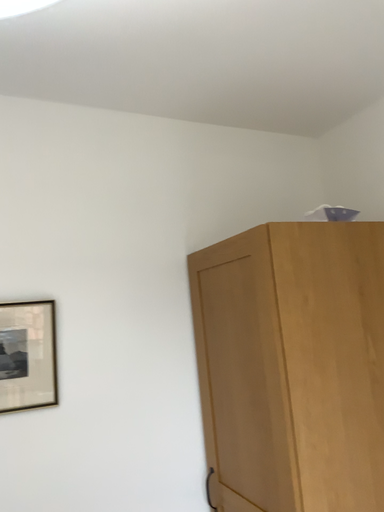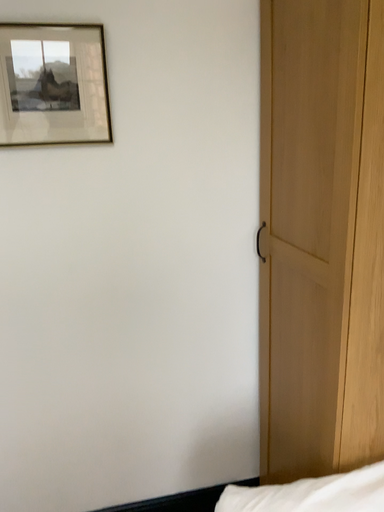
Question: Which way did the camera rotate in the video?

Choices:
 (A) rotated downward
 (B) rotated upward

Answer: (A)